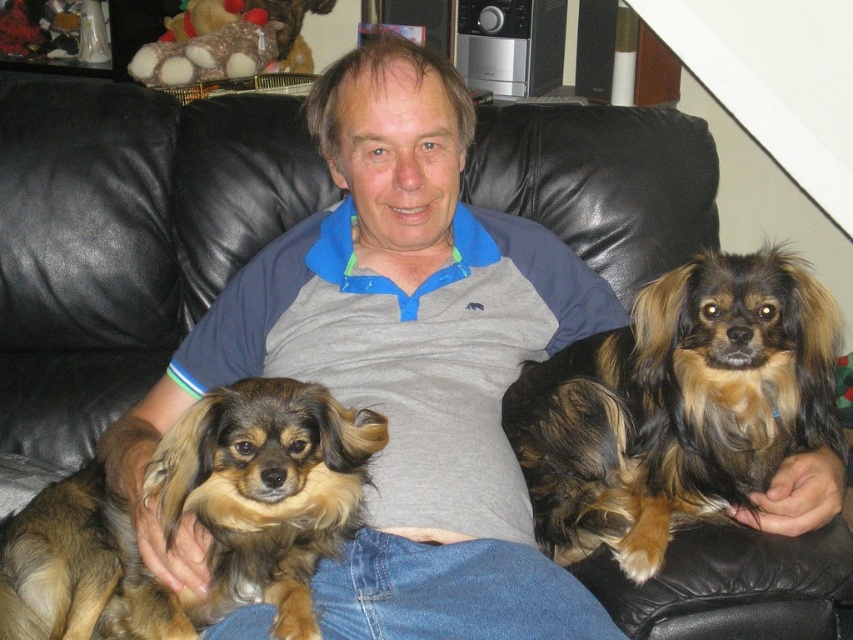
Is brown shaggy dog at right taller than fuzzy brown dog at center?

Indeed, brown shaggy dog at right has a greater height compared to fuzzy brown dog at center.

Measure the distance from brown shaggy dog at right to fuzzy brown dog at center.

16.55 inches

In order to click on brown shaggy dog at right in this screenshot , I will do `click(676, 406)`.

Where is `brown shaggy dog at right`? This screenshot has width=853, height=640. brown shaggy dog at right is located at coordinates (676, 406).